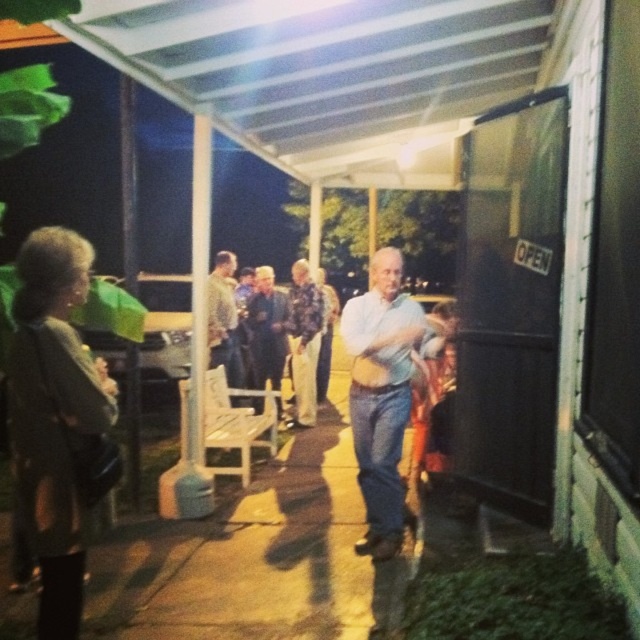
Question: Which is nearer to the light blue jeans at center?

Choices:
 (A) light brown leather jacket at center
 (B) floral-patterned shirt at center

Answer: (A)

Question: Can you confirm if light blue jeans at center is positioned to the right of floral-patterned shirt at center?

Choices:
 (A) no
 (B) yes

Answer: (B)

Question: Which point appears farthest from the camera in this image?

Choices:
 (A) click(x=221, y=330)
 (B) click(x=371, y=301)
 (C) click(x=301, y=362)

Answer: (C)

Question: Can you confirm if floral-patterned shirt at center is positioned to the right of light brown leather jacket at center?

Choices:
 (A) no
 (B) yes

Answer: (B)

Question: Is floral-patterned shirt at center below light brown leather jacket at center?

Choices:
 (A) no
 (B) yes

Answer: (B)

Question: Which object appears farthest from the camera in this image?

Choices:
 (A) light brown leather jacket at center
 (B) light blue jeans at center
 (C) floral-patterned shirt at center

Answer: (C)